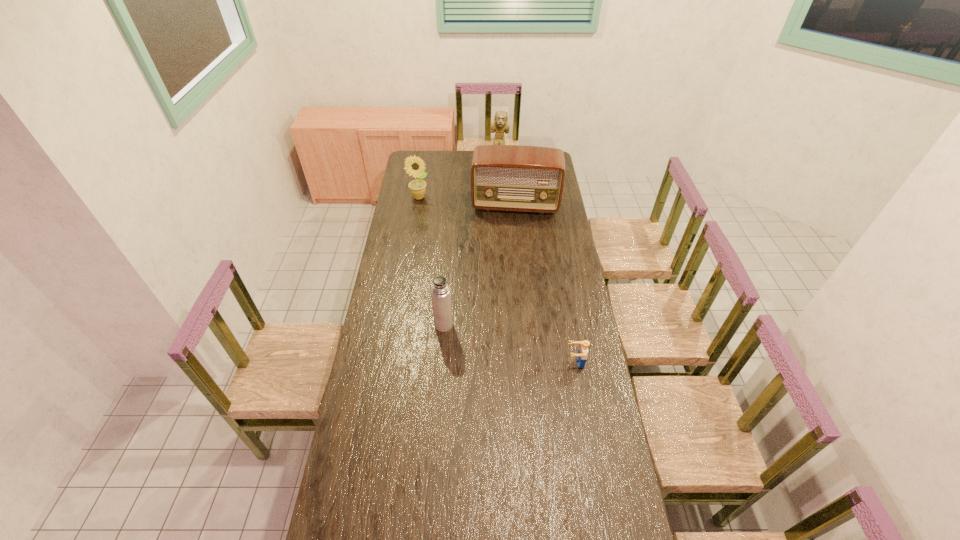
The height and width of the screenshot is (540, 960). What are the coordinates of `vacant area that lies between the fourth farthest object and the sunflower` in the screenshot? It's located at (431, 261).

The image size is (960, 540). Identify the location of empty location between the Lego and the farthest object. (537, 262).

I want to click on free spot between the figurine and the shortest object, so click(537, 262).

The width and height of the screenshot is (960, 540). I want to click on vacant space that's between the radio receiver and the fourth object from right to left, so [479, 265].

The width and height of the screenshot is (960, 540). In order to click on free space between the radio receiver and the thermos bottle in this screenshot , I will do `click(479, 265)`.

You are a GUI agent. You are given a task and a screenshot of the screen. Output one action in this format:
    pyautogui.click(x=<x>, y=<y>)
    Task: Click on the vacant region between the leftmost object and the fourth farthest object
    This screenshot has width=960, height=540.
    Given the screenshot: What is the action you would take?
    pyautogui.click(x=431, y=261)

Where is `vacant area that lies between the nearest object and the farthest object`? The width and height of the screenshot is (960, 540). vacant area that lies between the nearest object and the farthest object is located at coordinates (537, 262).

This screenshot has height=540, width=960. Identify the location of vacant area that lies between the leftmost object and the farthest object. (459, 180).

At what (x,y) coordinates should I click in order to perform the action: click on vacant space that is in between the nearest object and the figurine. Please return your answer as a coordinate pair (x, y). This screenshot has height=540, width=960. Looking at the image, I should click on (537, 262).

Locate which object is the fourth closest to the radio receiver. Please provide its 2D coordinates. Your answer should be formatted as a tuple, i.e. [(x, y)], where the tuple contains the x and y coordinates of a point satisfying the conditions above.

[(581, 357)]